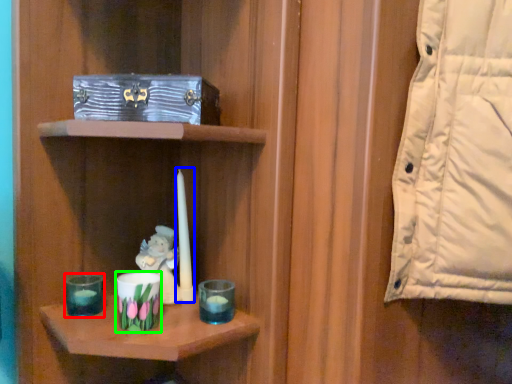
Question: Which object is positioned farthest from candle holder (highlighted by a red box)? Select from birthday candle (highlighted by a blue box) and candle holder (highlighted by a green box).

Choices:
 (A) birthday candle
 (B) candle holder

Answer: (A)